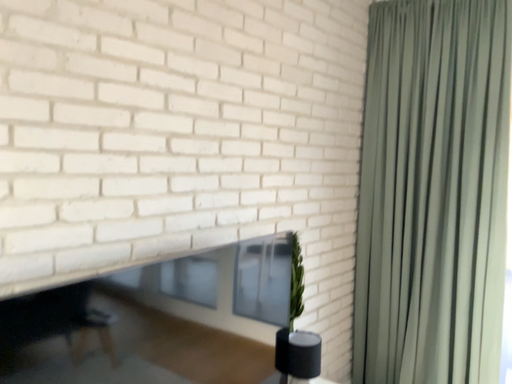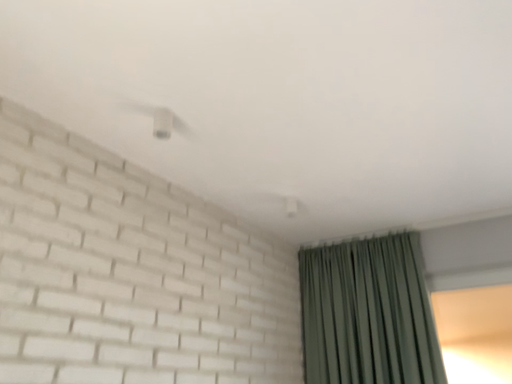
Question: Which way did the camera rotate in the video?

Choices:
 (A) rotated right
 (B) rotated left

Answer: (A)